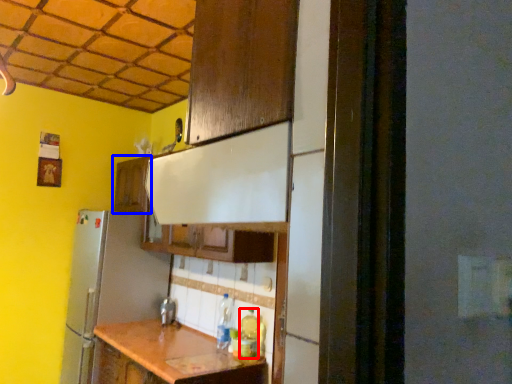
Question: Which object appears farthest to the camera in this image, bottle (highlighted by a red box) or cabinetry (highlighted by a blue box)?

Choices:
 (A) bottle
 (B) cabinetry

Answer: (B)